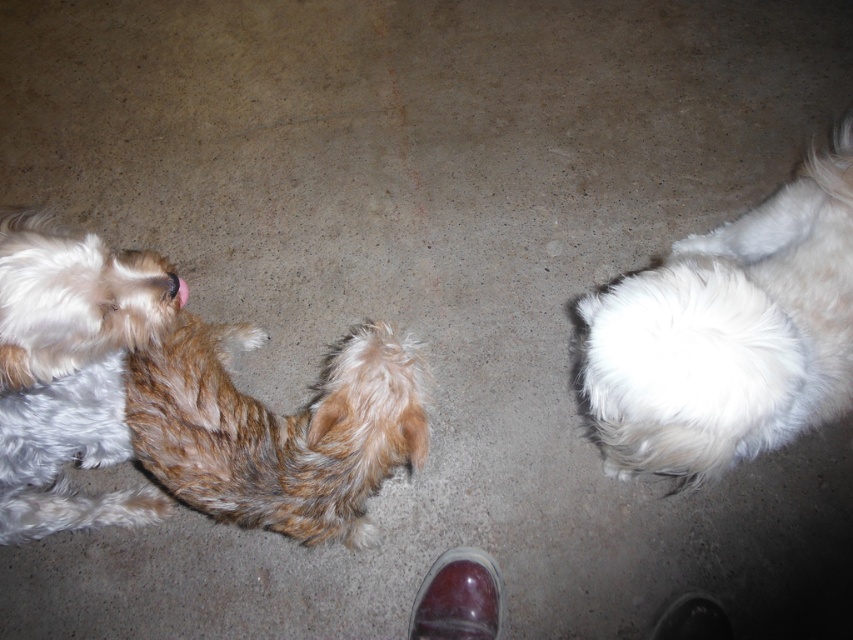
Is white fluffy dog at right to the right of brown shaggy dog at left from the viewer's perspective?

Indeed, white fluffy dog at right is positioned on the right side of brown shaggy dog at left.

Describe the element at coordinates (729, 333) in the screenshot. The width and height of the screenshot is (853, 640). I see `white fluffy dog at right` at that location.

Who is more distant from viewer, (848, 365) or (9, 220)?

The point (9, 220) is more distant.

Identify the location of white fluffy dog at right. (729, 333).

Does brown fuzzy tail at center have a greater width compared to brown shaggy dog at left?

Yes.

Is brown fuzzy tail at center to the left of brown shaggy dog at left from the viewer's perspective?

In fact, brown fuzzy tail at center is to the right of brown shaggy dog at left.

What are the coordinates of `brown fuzzy tail at center` in the screenshot? It's located at (276, 429).

Does white fluffy dog at right have a larger size compared to brown fuzzy tail at center?

Indeed, white fluffy dog at right has a larger size compared to brown fuzzy tail at center.

Can you confirm if white fluffy dog at right is positioned to the left of brown fuzzy tail at center?

Incorrect, white fluffy dog at right is not on the left side of brown fuzzy tail at center.

Who is more distant from viewer, (659,384) or (131,362)?

Point (131,362)

Where is `white fluffy dog at right`? The height and width of the screenshot is (640, 853). white fluffy dog at right is located at coordinates (729, 333).